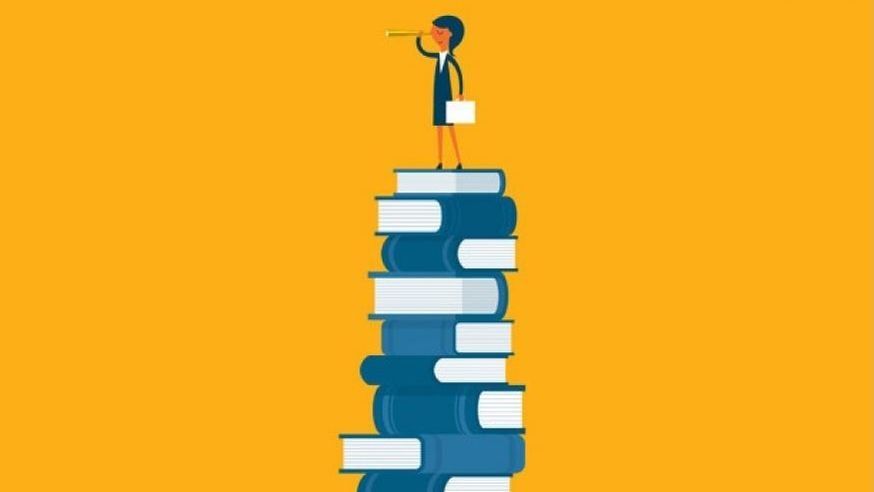
In order to click on blue stacked books in this screenshot , I will do `click(435, 486)`, `click(447, 457)`, `click(440, 408)`, `click(418, 376)`, `click(437, 347)`, `click(448, 305)`, `click(438, 261)`, `click(440, 229)`, `click(446, 183)`.